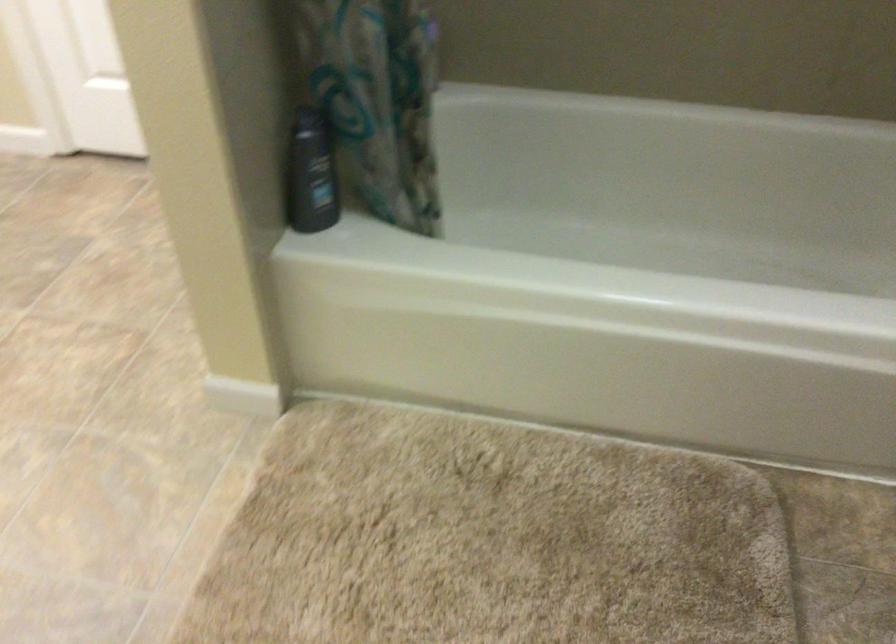
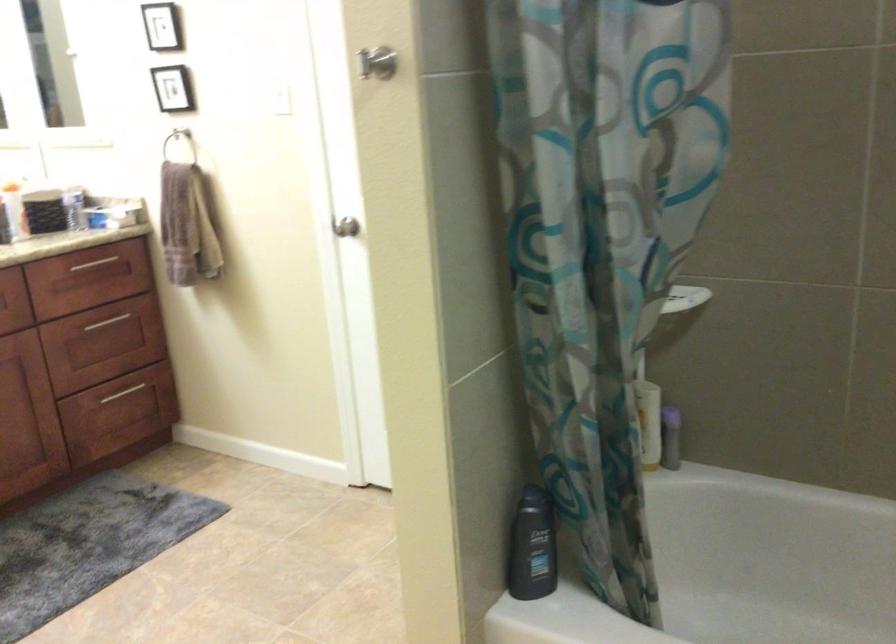
First-person continuous shooting, in which direction is the camera rotating?

The camera rotated toward left-up.